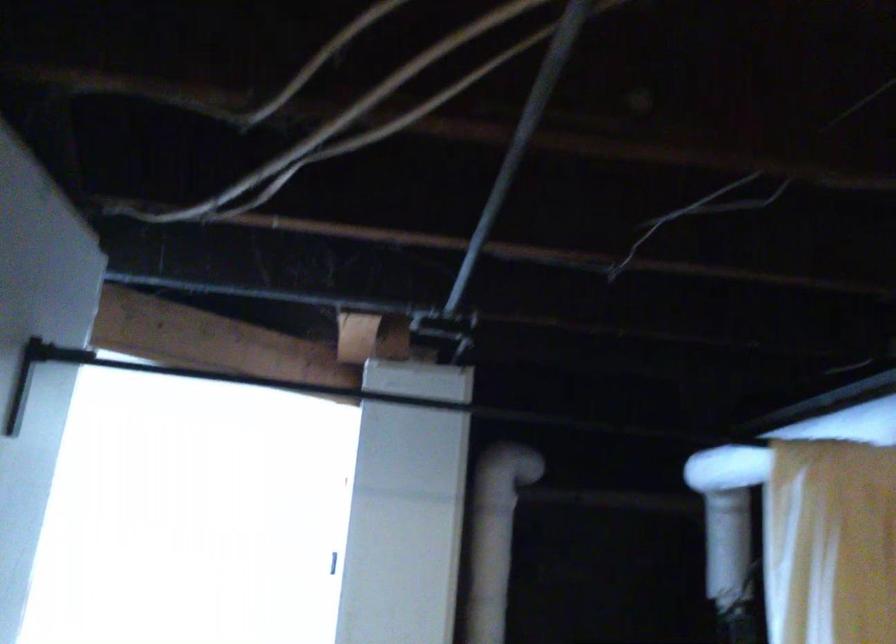
How did the camera likely rotate?

The rotation direction of the camera is left-up.